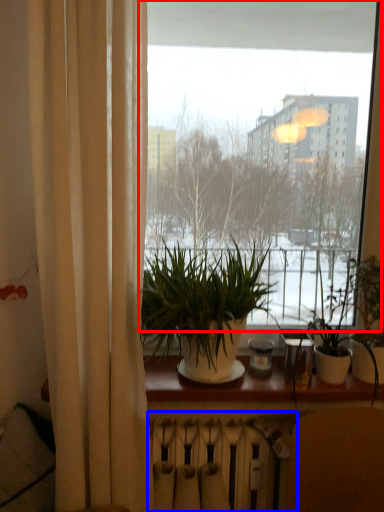
Question: Which object is closer to the camera taking this photo, window (highlighted by a red box) or radiator (highlighted by a blue box)?

Choices:
 (A) window
 (B) radiator

Answer: (A)